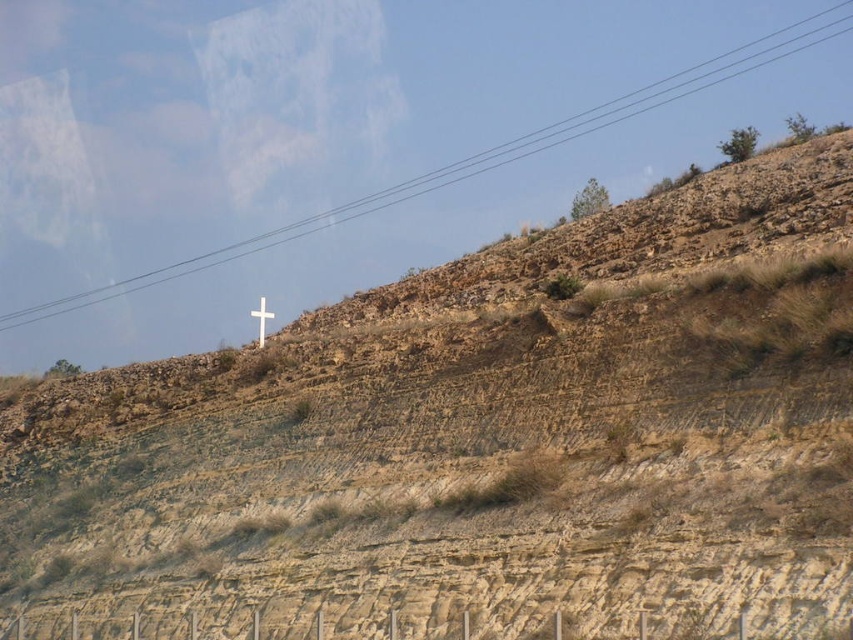
Question: From the image, what is the correct spatial relationship of black wire at upper center in relation to white wooden cross at upper center?

Choices:
 (A) left
 (B) right

Answer: (B)

Question: Does black wire at upper center appear under white wooden cross at upper center?

Choices:
 (A) yes
 (B) no

Answer: (B)

Question: Is black wire at upper center positioned before white wooden cross at upper center?

Choices:
 (A) yes
 (B) no

Answer: (B)